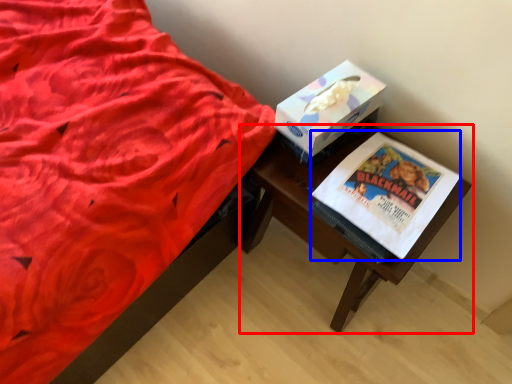
Question: Which object is closer to the camera taking this photo, table (highlighted by a red box) or paperback book (highlighted by a blue box)?

Choices:
 (A) table
 (B) paperback book

Answer: (B)